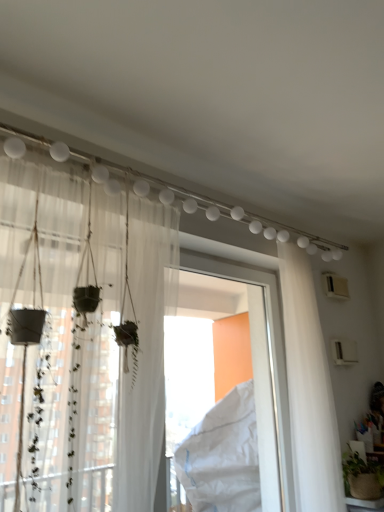
Question: From a real-world perspective, does white plastic window frame at center sit lower than white sheer curtain at right, the second curtain in the left-to-right sequence?

Choices:
 (A) no
 (B) yes

Answer: (B)

Question: Is white plastic window frame at center positioned before white sheer curtain at right, the 1th curtain viewed from the back?

Choices:
 (A) no
 (B) yes

Answer: (B)

Question: Is white plastic window frame at center positioned beyond the bounds of white sheer curtain at right, which ranks as the first curtain in right-to-left order?

Choices:
 (A) yes
 (B) no

Answer: (A)

Question: Is white plastic window frame at center looking in the opposite direction of white sheer curtain at right, the second curtain in the left-to-right sequence?

Choices:
 (A) no
 (B) yes

Answer: (B)

Question: Considering the relative sizes of white plastic window frame at center and white sheer curtain at right, the 1th curtain viewed from the back, in the image provided, is white plastic window frame at center bigger than white sheer curtain at right, the 1th curtain viewed from the back,?

Choices:
 (A) yes
 (B) no

Answer: (A)

Question: From the image's perspective, is white sheer curtain at right, the second curtain viewed from the front, positioned above or below white plastic window frame at center?

Choices:
 (A) below
 (B) above

Answer: (B)

Question: In terms of height, does white sheer curtain at right, the second curtain viewed from the front, look taller or shorter compared to white plastic window frame at center?

Choices:
 (A) short
 (B) tall

Answer: (B)

Question: From a real-world perspective, is white sheer curtain at right, the 1th curtain viewed from the back, physically located above or below white plastic window frame at center?

Choices:
 (A) above
 (B) below

Answer: (A)

Question: Is white sheer curtain at right, the second curtain in the left-to-right sequence, wider or thinner than white plastic window frame at center?

Choices:
 (A) wide
 (B) thin

Answer: (A)

Question: From a real-world perspective, relative to white sheer curtain at right, which ranks as the first curtain in right-to-left order, is white plastic window frame at center vertically above or below?

Choices:
 (A) above
 (B) below

Answer: (B)

Question: Which is correct: white plastic window frame at center is inside white sheer curtain at right, the 1th curtain viewed from the back, or outside of it?

Choices:
 (A) inside
 (B) outside

Answer: (B)

Question: Is white plastic window frame at center wider or thinner than white sheer curtain at right, which ranks as the first curtain in right-to-left order?

Choices:
 (A) thin
 (B) wide

Answer: (A)

Question: From the image's perspective, is white plastic window frame at center located above or below white sheer curtain at right, which ranks as the first curtain in right-to-left order?

Choices:
 (A) below
 (B) above

Answer: (A)

Question: From their relative heights in the image, would you say white sheer curtain at right, which ranks as the first curtain in right-to-left order, is taller or shorter than sheer white curtain at left, the 2th curtain from the back?

Choices:
 (A) tall
 (B) short

Answer: (A)

Question: Considering the positions of white sheer curtain at right, the second curtain in the left-to-right sequence, and sheer white curtain at left, marked as the first curtain in a front-to-back arrangement, in the image, is white sheer curtain at right, the second curtain in the left-to-right sequence, bigger or smaller than sheer white curtain at left, marked as the first curtain in a front-to-back arrangement,?

Choices:
 (A) big
 (B) small

Answer: (B)